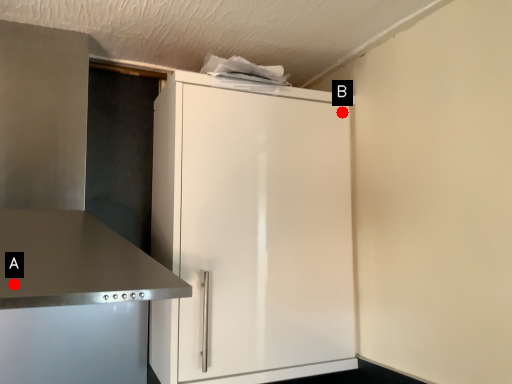
Question: Two points are circled on the image, labeled by A and B beside each circle. Among these points, which one is farthest from the camera?

Choices:
 (A) A is further
 (B) B is further

Answer: (B)